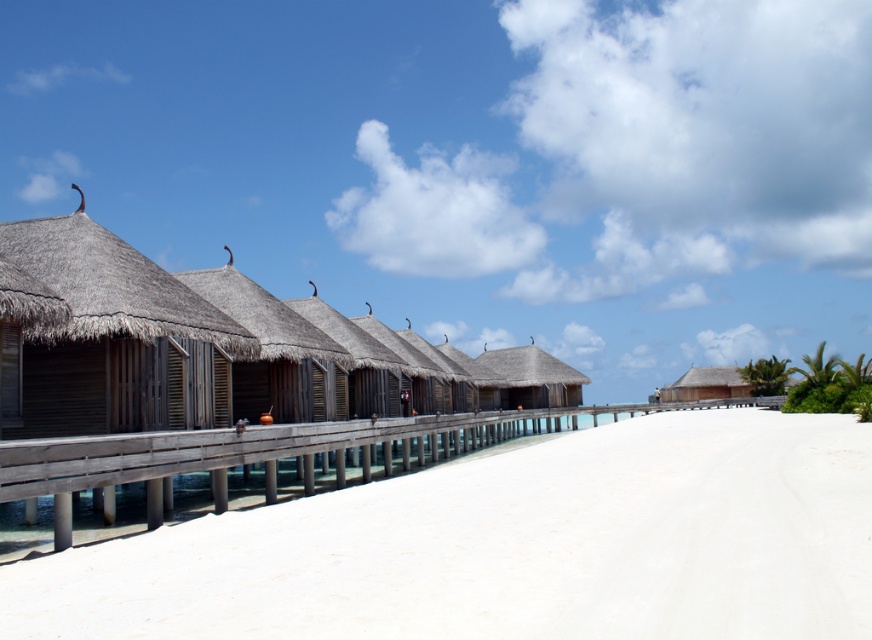
You are standing on the beach and want to reach the wooden walkway at center. Which object should you approach first, the wooden at center or the thatched wood hut at center?

You should approach the wooden at center first because it is closer to you than the thatched wood hut at center.

You are planning to build a new overwater bungalow on the beach. You have two options for the base structure. The first option is the wooden at center, and the second option is the thatched wood hut at center. Which structure has a wider base to accommodate more amenities?

The wooden at center has a larger width than the thatched wood hut at center, so it can accommodate more amenities.

You are standing on the beach and want to reach both points marked in the image. Which point, point (233, 435) or point (564, 388), is closer to you?

Point (233, 435) is closer to you than point (564, 388).